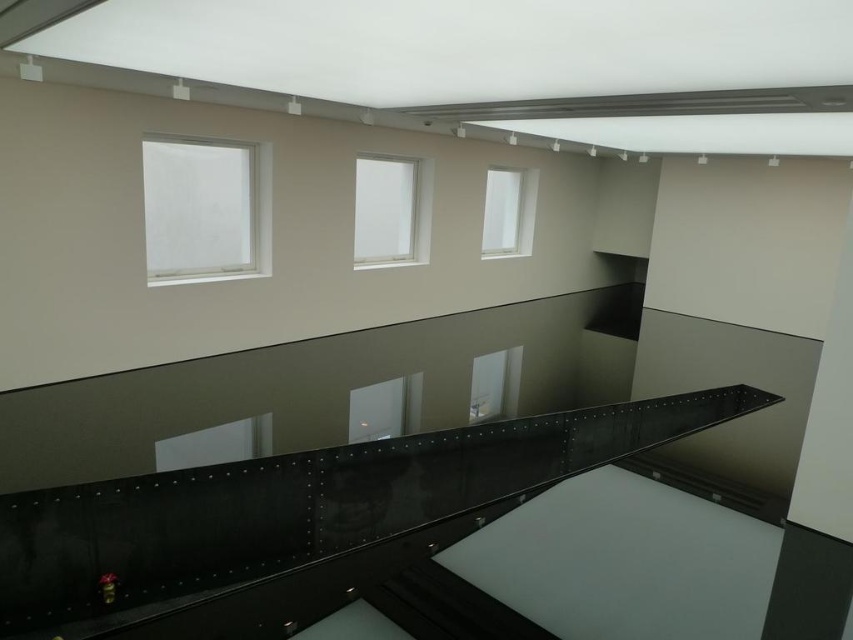
Is white matte window at upper left further to the viewer compared to white matte window at upper center?

No, it is in front of white matte window at upper center.

Is white matte window at upper left to the left of white matte window at upper center from the viewer's perspective?

Indeed, white matte window at upper left is positioned on the left side of white matte window at upper center.

The width and height of the screenshot is (853, 640). I want to click on white matte window at upper left, so click(x=204, y=209).

Does glossy metal balustrade at center have a smaller size compared to clear glass window at center?

Actually, glossy metal balustrade at center might be larger than clear glass window at center.

What do you see at coordinates (297, 522) in the screenshot?
I see `glossy metal balustrade at center` at bounding box center [297, 522].

This screenshot has width=853, height=640. Describe the element at coordinates (297, 522) in the screenshot. I see `glossy metal balustrade at center` at that location.

Where is `glossy metal balustrade at center`? glossy metal balustrade at center is located at coordinates (297, 522).

Does glossy metal balustrade at center lie behind white matte window at upper center?

No, glossy metal balustrade at center is in front of white matte window at upper center.

Can you confirm if glossy metal balustrade at center is taller than white matte window at upper center?

Incorrect, glossy metal balustrade at center's height is not larger of white matte window at upper center's.

At what (x,y) coordinates should I click in order to perform the action: click on glossy metal balustrade at center. Please return your answer as a coordinate pair (x, y). Image resolution: width=853 pixels, height=640 pixels. Looking at the image, I should click on (297, 522).